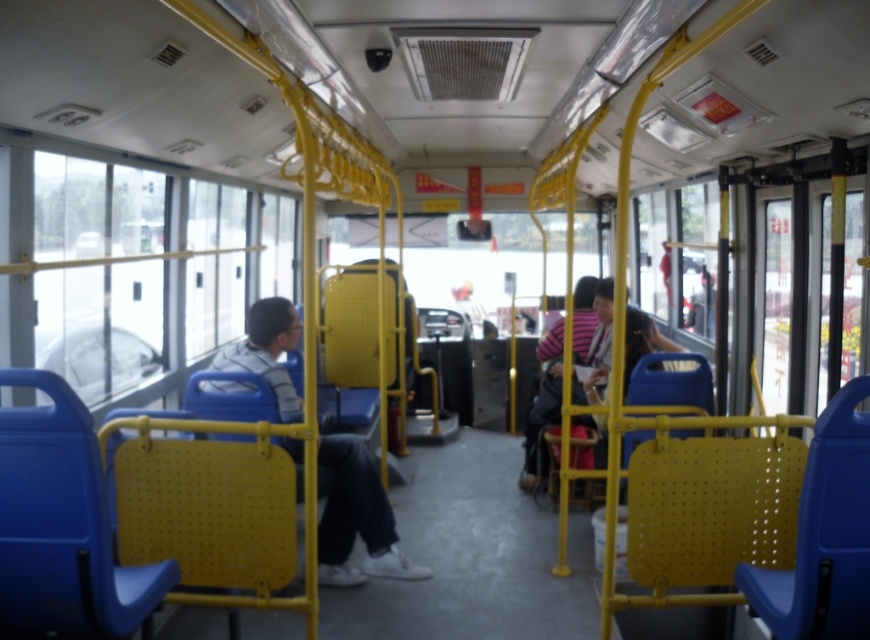
Question: Does matte blue jeans at center have a greater width compared to striped fabric shirt at center?

Choices:
 (A) yes
 (B) no

Answer: (A)

Question: Can you confirm if matte blue jeans at center is positioned below striped fabric shirt at center?

Choices:
 (A) no
 (B) yes

Answer: (B)

Question: From the image, what is the correct spatial relationship of matte blue jeans at center in relation to striped fabric shirt at center?

Choices:
 (A) left
 (B) right

Answer: (A)

Question: Which of the following is the closest to the observer?

Choices:
 (A) striped fabric shirt at center
 (B) matte blue jeans at center

Answer: (B)